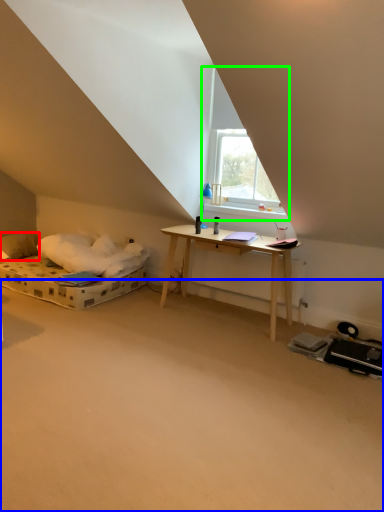
Question: Based on their relative distances, which object is nearer to pillow (highlighted by a red box)? Choose from plain (highlighted by a blue box) and window (highlighted by a green box).

Choices:
 (A) plain
 (B) window

Answer: (B)